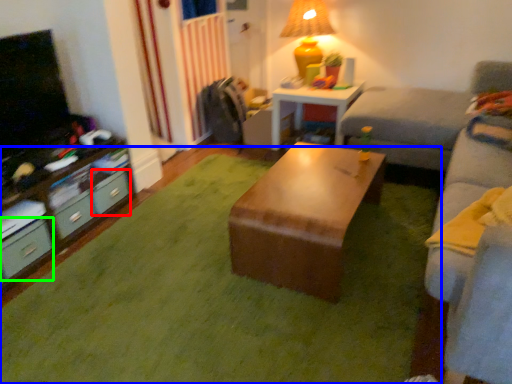
Question: Which object is the farthest from drawer (highlighted by a red box)? Choose among these: grass (highlighted by a blue box) or drawer (highlighted by a green box).

Choices:
 (A) grass
 (B) drawer

Answer: (A)